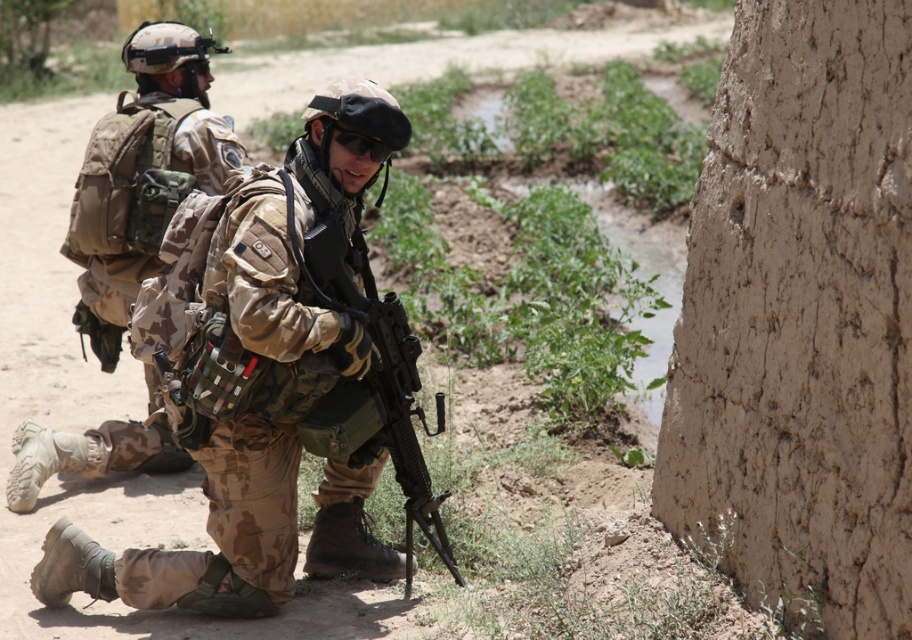
Is camouflage fabric uniform at center to the right of matte black rifle at center from the viewer's perspective?

In fact, camouflage fabric uniform at center is to the left of matte black rifle at center.

Between point (252, 292) and point (420, 385), which one is positioned in front?

Positioned in front is point (252, 292).

Which is behind, point (284, 269) or point (406, 376)?

The point (406, 376) is more distant.

You are a GUI agent. You are given a task and a screenshot of the screen. Output one action in this format:
    pyautogui.click(x=<x>, y=<y>)
    Task: Click on the camouflage fabric uniform at center
    The height and width of the screenshot is (640, 912).
    Given the screenshot: What is the action you would take?
    pyautogui.click(x=208, y=532)

Who is lower down, camouflage fabric uniform at center or camouflage fabric uniform at left?

camouflage fabric uniform at center

Is point (317, 196) positioned behind point (140, 435)?

No, (317, 196) is in front of (140, 435).

Find the location of a particular element. This screenshot has height=640, width=912. camouflage fabric uniform at center is located at coordinates (208, 532).

Is camouflage fabric uniform at left bigger than matte black rifle at center?

Yes, camouflage fabric uniform at left is bigger than matte black rifle at center.

Can you confirm if camouflage fabric uniform at left is positioned to the right of matte black rifle at center?

No, camouflage fabric uniform at left is not to the right of matte black rifle at center.

Is point (104, 442) in front of point (385, 435)?

No, it is not.

Where is `camouflage fabric uniform at left`? camouflage fabric uniform at left is located at coordinates (143, 176).